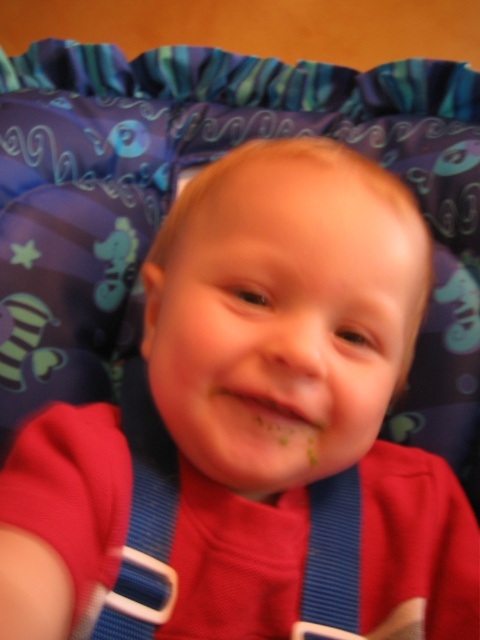
Question: Observing the image, what is the correct spatial positioning of smooth skin face at center in reference to blue fabric strap at center?

Choices:
 (A) above
 (B) below

Answer: (A)

Question: Does smooth skin face at center appear under blue fabric strap at center?

Choices:
 (A) no
 (B) yes

Answer: (A)

Question: Which object appears closest to the camera in this image?

Choices:
 (A) smooth skin face at center
 (B) blue fabric strap at center

Answer: (A)

Question: Which of the following is the closest to the observer?

Choices:
 (A) (243, 380)
 (B) (173, 449)

Answer: (A)

Question: Does smooth skin face at center appear on the right side of blue fabric strap at center?

Choices:
 (A) no
 (B) yes

Answer: (B)